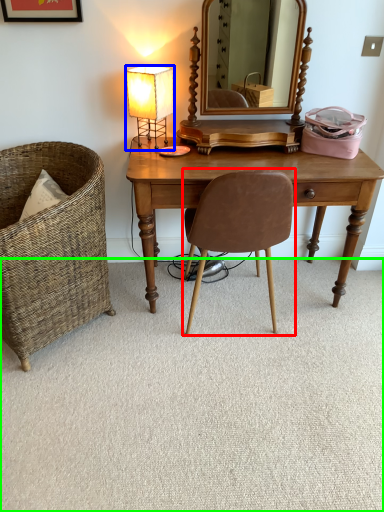
Question: Which is farther away from chair (highlighted by a red box)? lamp (highlighted by a blue box) or plain (highlighted by a green box)?

Choices:
 (A) lamp
 (B) plain

Answer: (A)